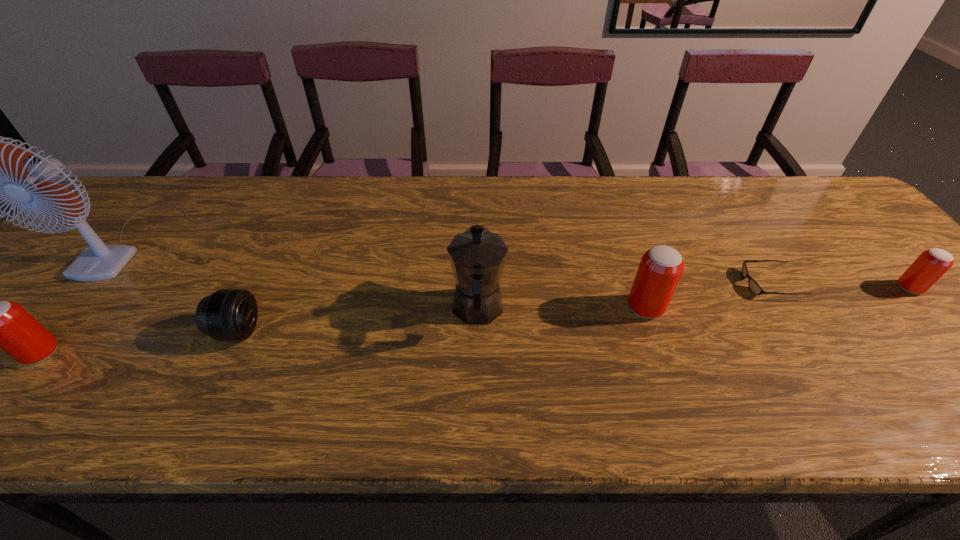
Please point a spot to place another beer_can for symmetrical spacing. Please provide its 2D coordinates. Your answer should be formatted as a tuple, i.e. [(x, y)], where the tuple contains the x and y coordinates of a point satisfying the conditions above.

[(357, 329)]